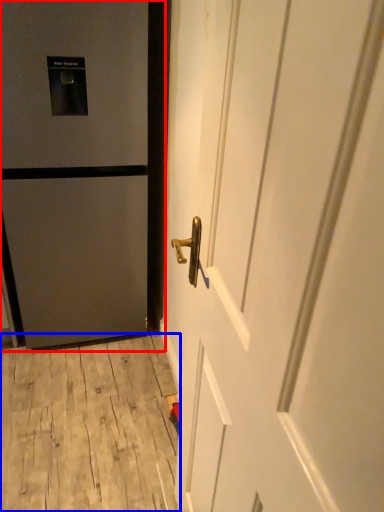
Question: Among these objects, which one is nearest to the camera, door (highlighted by a red box) or plywood (highlighted by a blue box)?

Choices:
 (A) door
 (B) plywood

Answer: (A)